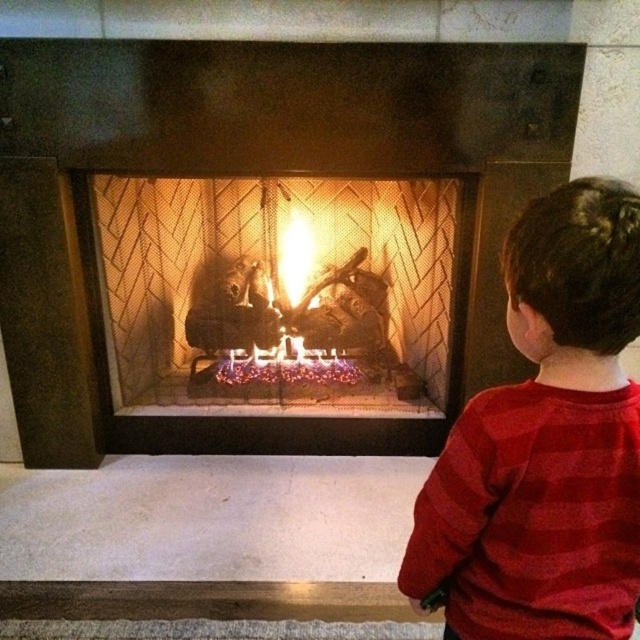
Question: Which point is farther from the camera taking this photo?

Choices:
 (A) (506, 541)
 (B) (321, 353)

Answer: (B)

Question: Which object is farther from the camera taking this photo?

Choices:
 (A) red striped shirt at right
 (B) glowing embers at center
 (C) matte black fireplace at center

Answer: (B)

Question: Does matte black fireplace at center have a greater width compared to red striped shirt at right?

Choices:
 (A) yes
 (B) no

Answer: (A)

Question: Considering the relative positions of matte black fireplace at center and glowing embers at center in the image provided, where is matte black fireplace at center located with respect to glowing embers at center?

Choices:
 (A) left
 (B) right

Answer: (A)

Question: Which point appears closest to the camera in this image?

Choices:
 (A) (504, 227)
 (B) (568, 612)

Answer: (B)

Question: Is matte black fireplace at center wider than red striped shirt at right?

Choices:
 (A) no
 (B) yes

Answer: (B)